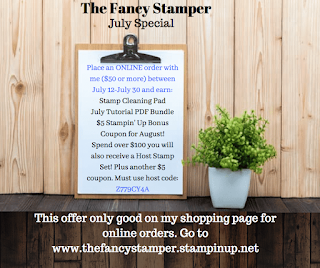
Where is `pot`? pot is located at coordinates (230, 189).